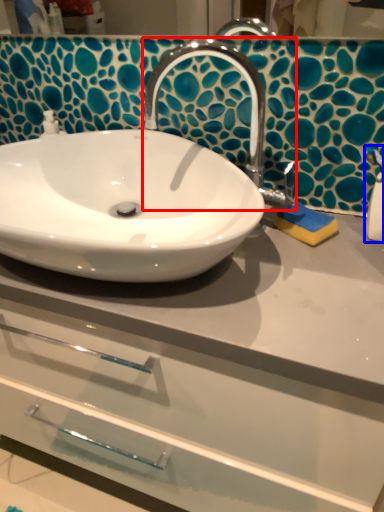
Question: Which point is further to the camera, tap (highlighted by a red box) or soap dispenser (highlighted by a blue box)?

Choices:
 (A) tap
 (B) soap dispenser

Answer: (B)